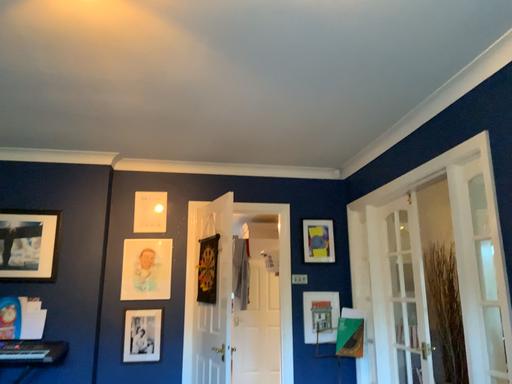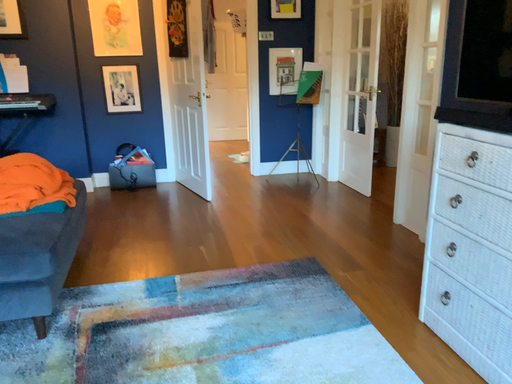
Question: How did the camera likely rotate when shooting the video?

Choices:
 (A) rotated downward
 (B) rotated upward

Answer: (A)